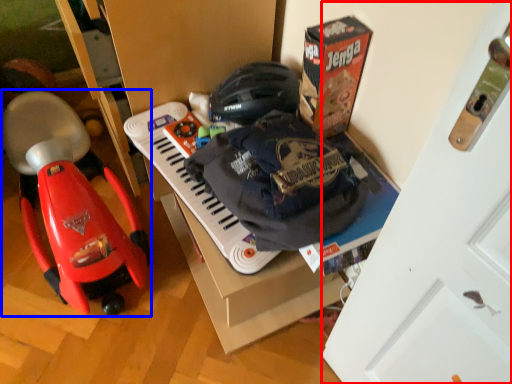
Question: Among these objects, which one is farthest to the camera, door (highlighted by a red box) or baby carriage (highlighted by a blue box)?

Choices:
 (A) door
 (B) baby carriage

Answer: (B)